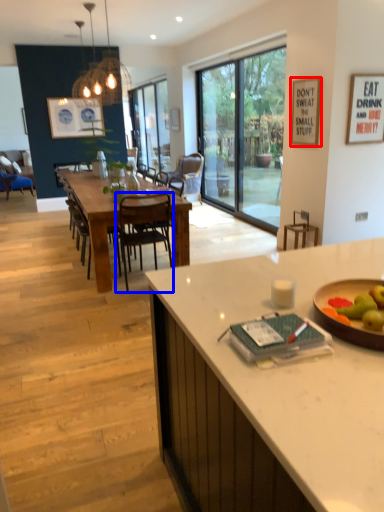
Question: Which object is closer to the camera taking this photo, picture frame (highlighted by a red box) or chair (highlighted by a blue box)?

Choices:
 (A) picture frame
 (B) chair

Answer: (B)